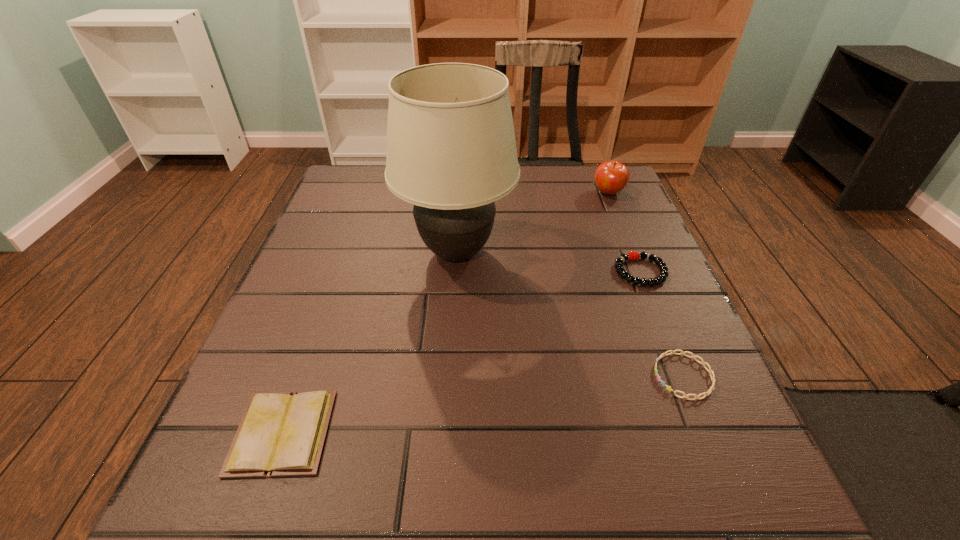
Locate an element on the screen. The image size is (960, 540). object that is at the far right corner is located at coordinates (611, 177).

Locate an element on the screen. This screenshot has height=540, width=960. vacant space at the far edge of the desktop is located at coordinates point(560,187).

Find the location of `free region at the near edge`. free region at the near edge is located at coordinates (335, 506).

This screenshot has height=540, width=960. Find the location of `vacant space at the left edge of the desktop`. vacant space at the left edge of the desktop is located at coordinates (348, 300).

I want to click on vacant area at the right edge of the desktop, so click(600, 296).

Image resolution: width=960 pixels, height=540 pixels. What are the coordinates of `free space at the far right corner of the desktop` in the screenshot? It's located at (617, 200).

This screenshot has width=960, height=540. Find the location of `vacant area that lies between the farthest object and the tallest object`. vacant area that lies between the farthest object and the tallest object is located at coordinates (533, 223).

Where is `empty space that is in between the second object from left to right and the diary`? Image resolution: width=960 pixels, height=540 pixels. empty space that is in between the second object from left to right and the diary is located at coordinates (370, 343).

This screenshot has width=960, height=540. I want to click on free space between the nearer bracelet and the tallest object, so click(570, 315).

You are a GUI agent. You are given a task and a screenshot of the screen. Output one action in this format:
    pyautogui.click(x=<x>, y=<y>)
    Task: Click on the free space between the shortest object and the taller bracelet
    This screenshot has height=540, width=960.
    Given the screenshot: What is the action you would take?
    pyautogui.click(x=661, y=324)